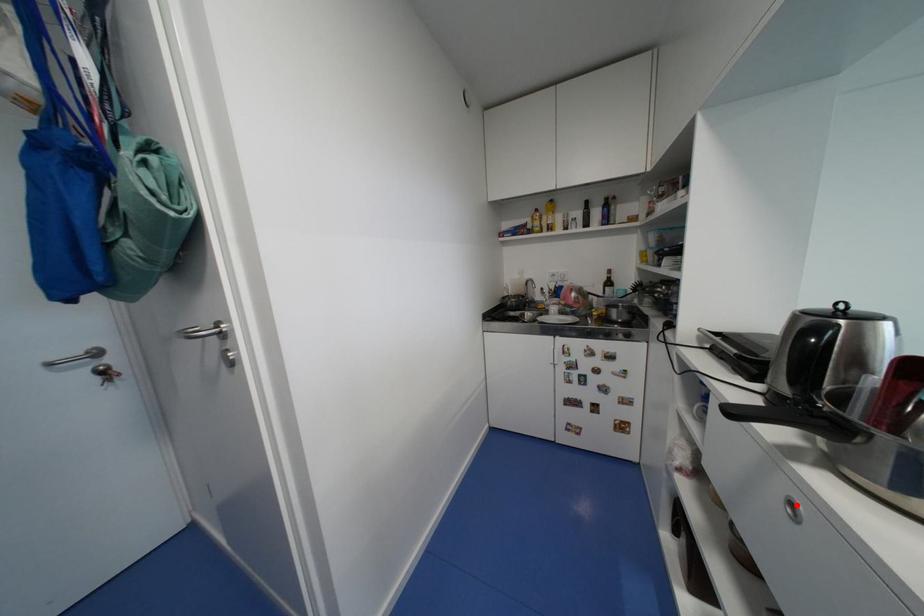
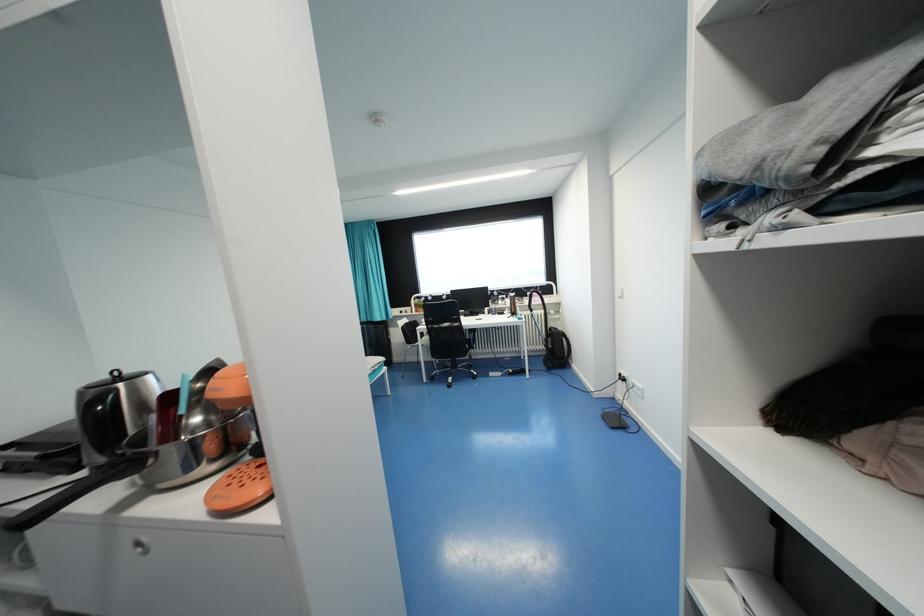
Where in the second image is the point corresponding to the highlighted location from the first image?

(142, 545)